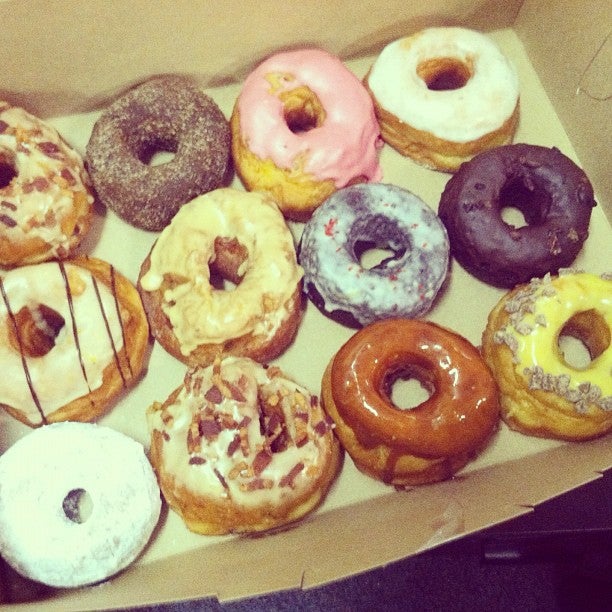
Locate an element on the screen. surface is located at coordinates (460, 592).